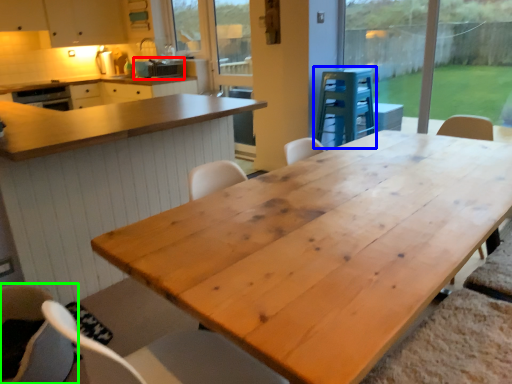
Question: Which is farther away from appliance (highlighted by a red box)? appliance (highlighted by a blue box) or chair (highlighted by a green box)?

Choices:
 (A) appliance
 (B) chair

Answer: (B)